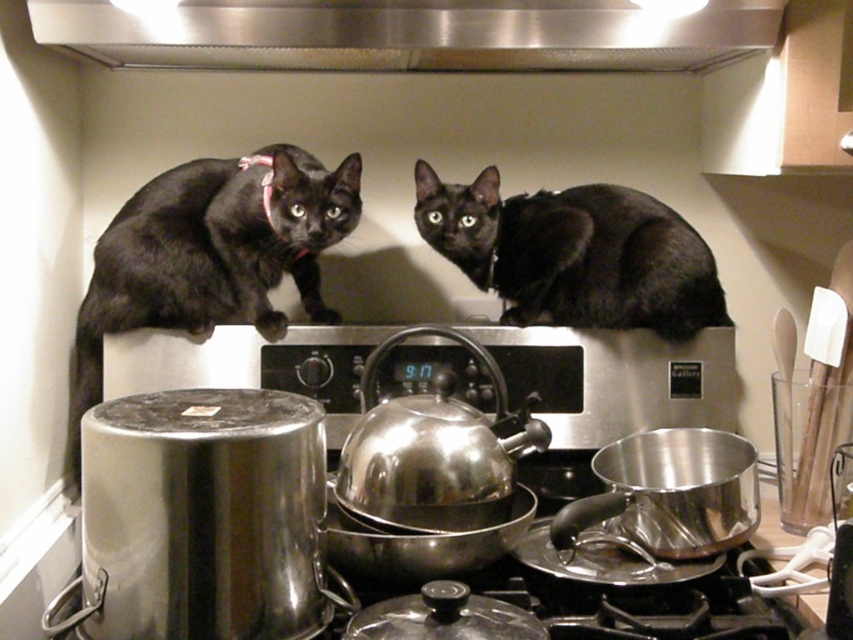
Based on the photo, you are a photographer trying to capture the exact spot where the matte black cat at upper left is located. According to the image coordinates, where should you aim your camera?

The matte black cat at upper left is located at coordinates point (210, 253).

You are a photographer trying to capture both the matte black cat at upper left and the black matte cat at upper center in a single frame. Given their sizes, which cat might require more careful positioning to ensure it fits entirely within the camera frame?

The matte black cat at upper left has a lesser width compared to the black matte cat at upper center, so it might require more careful positioning to ensure it fits entirely within the camera frame since it is smaller and could be easily missed or partially captured.